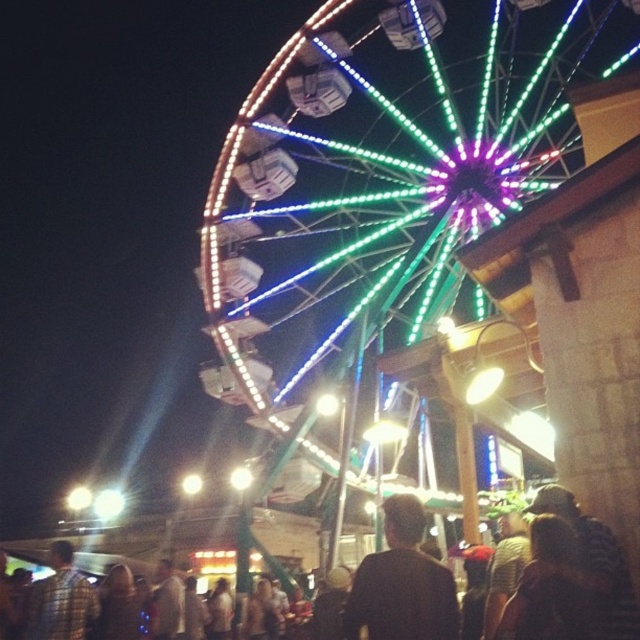
Image resolution: width=640 pixels, height=640 pixels. What do you see at coordinates (381, 173) in the screenshot?
I see `illuminated metal ferris wheel at upper center` at bounding box center [381, 173].

Consider the image. Measure the distance between point (260,288) and camera.

They are 121.31 meters apart.

Identify the location of illuminated metal ferris wheel at upper center. (381, 173).

Locate an element on the screen. Image resolution: width=640 pixels, height=640 pixels. illuminated metal ferris wheel at upper center is located at coordinates (381, 173).

Is illuminated metal ferris wheel at upper center taller than plaid shirt at lower left?

Indeed, illuminated metal ferris wheel at upper center has a greater height compared to plaid shirt at lower left.

Locate an element on the screen. This screenshot has height=640, width=640. illuminated metal ferris wheel at upper center is located at coordinates (381, 173).

You are a GUI agent. You are given a task and a screenshot of the screen. Output one action in this format:
    pyautogui.click(x=<x>, y=<y>)
    Task: Click on the illuminated metal ferris wheel at upper center
    The height and width of the screenshot is (640, 640).
    Given the screenshot: What is the action you would take?
    pyautogui.click(x=381, y=173)

Measure the distance between black matte shirt at center and camera.

black matte shirt at center is 53.63 meters from camera.

Which is more to the left, black matte shirt at center or plaid shirt at lower left?

From the viewer's perspective, plaid shirt at lower left appears more on the left side.

Which is behind, point (385, 637) or point (74, 618)?

The point (74, 618) is more distant.

At what (x,y) coordinates should I click in order to perform the action: click on black matte shirt at center. Please return your answer as a coordinate pair (x, y). Looking at the image, I should click on (401, 582).